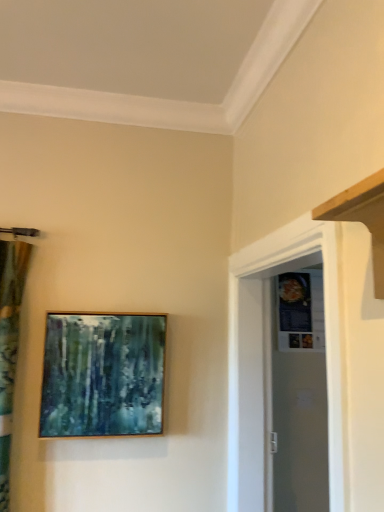
The width and height of the screenshot is (384, 512). Describe the element at coordinates (102, 375) in the screenshot. I see `metallic gold picture frame at upper center` at that location.

What is the approximate height of metallic gold picture frame at upper center?

metallic gold picture frame at upper center is 18.88 inches tall.

What is the approximate width of metallic gold picture frame at upper center?

3.66 inches.

The image size is (384, 512). In order to click on metallic gold picture frame at upper center in this screenshot , I will do `click(102, 375)`.

The image size is (384, 512). In order to click on metallic gold picture frame at upper center in this screenshot , I will do `click(102, 375)`.